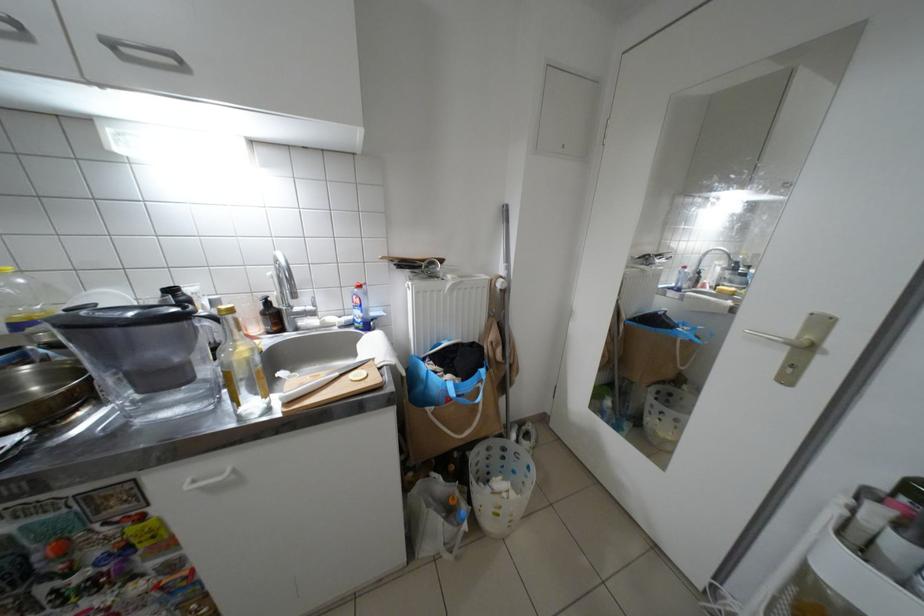
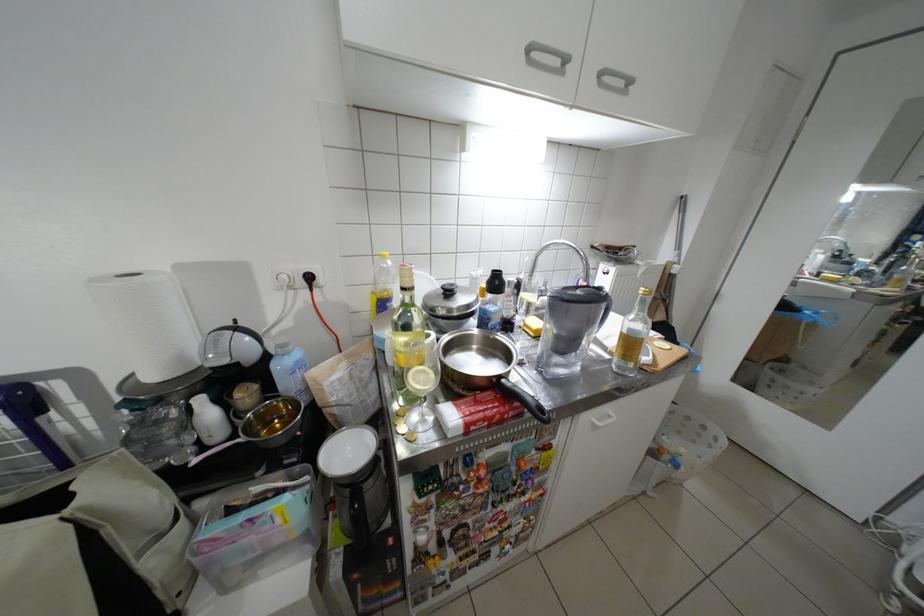
Find the pixel in the second image that matches (123,46) in the first image.

(613, 75)